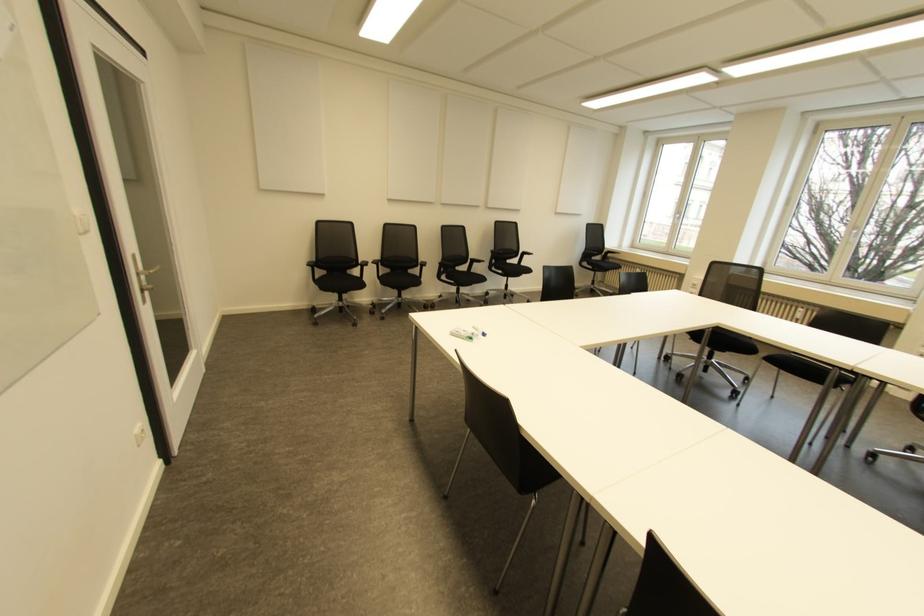
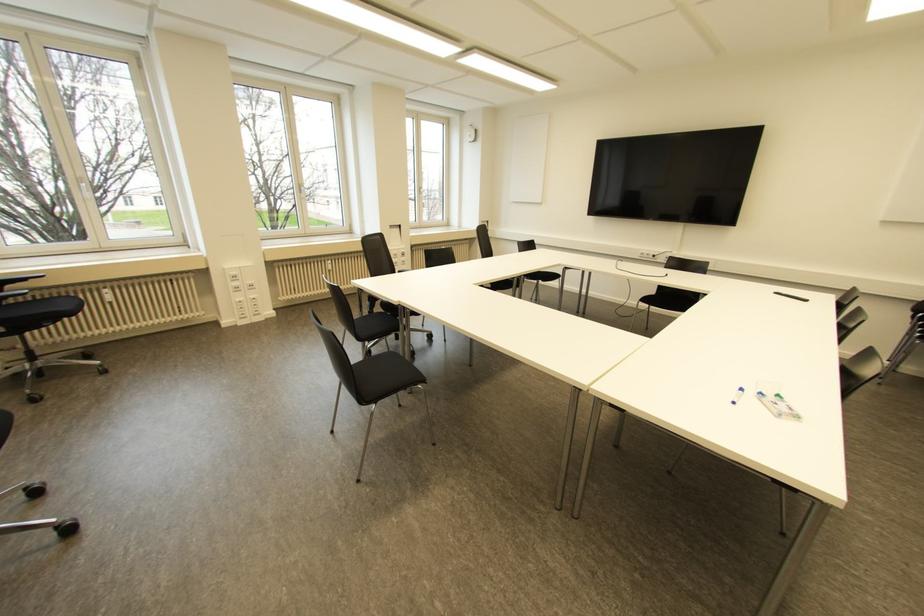
The point at (797, 315) is marked in the first image. Where is the corresponding point in the second image?

(330, 267)